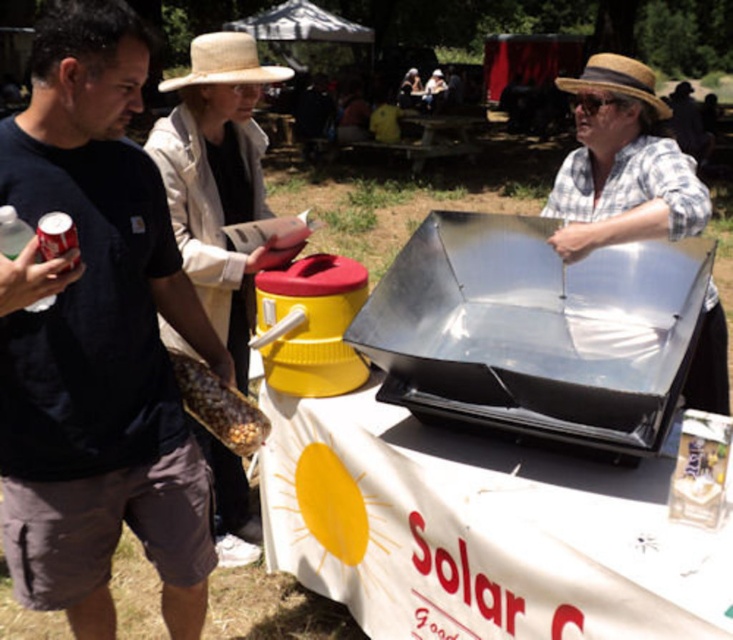
Question: Does brown textured corn at lower left appear under straw hat at upper center?

Choices:
 (A) yes
 (B) no

Answer: (A)

Question: Which of the following is the closest to the observer?

Choices:
 (A) shiny metallic solar cooker at center
 (B) straw hat at center
 (C) brown textured corn at lower left
 (D) straw hat at upper center

Answer: (A)

Question: Among these objects, which one is nearest to the camera?

Choices:
 (A) straw hat at upper center
 (B) white plastic table at center
 (C) dark blue t-shirt at left
 (D) shiny metallic solar cooker at center

Answer: (B)

Question: Is white plastic table at center below shiny metallic solar cooker at center?

Choices:
 (A) yes
 (B) no

Answer: (A)

Question: Is white plastic table at center bigger than straw hat at center?

Choices:
 (A) yes
 (B) no

Answer: (B)

Question: Based on their relative distances, which object is nearer to the dark blue t-shirt at left?

Choices:
 (A) shiny metallic solar cooker at center
 (B) straw hat at upper center
 (C) brown textured corn at lower left

Answer: (C)